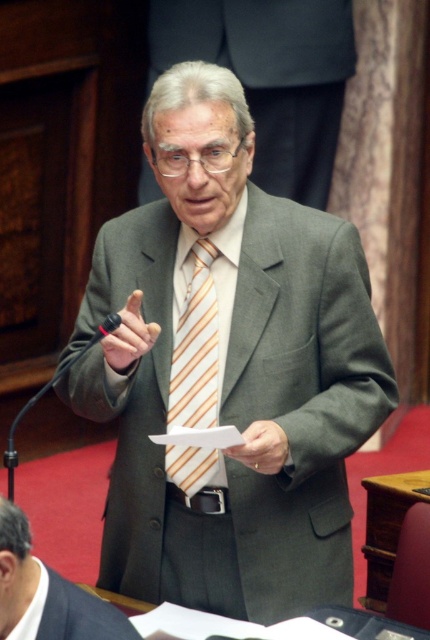
You are standing in the assembly hall and need to locate the central speaker. According to the image, where exactly is the gray suit at center positioned?

The gray suit at center is positioned at the coordinates point (46, 593).

You are a photographer trying to capture a closeup of the microphone in the scene. The point at coordinates (46,593) is on the gray suit at center. Where should you focus your camera to ensure the microphone is in sharp focus?

The point at coordinates (46,593) is on the gray suit at center, so to focus on the microphone, you should adjust your camera to focus on the microphone located near the central figure who is holding a piece of paper and addressing the audience.

You are a tailor observing the scene and need to determine which item requires more fabric for alterations. Based on the sizes of the gray suit at center and the striped fabric tie at center, which one would need more fabric?

The gray suit at center requires more fabric for alterations since it has a larger size compared to the striped fabric tie at center.